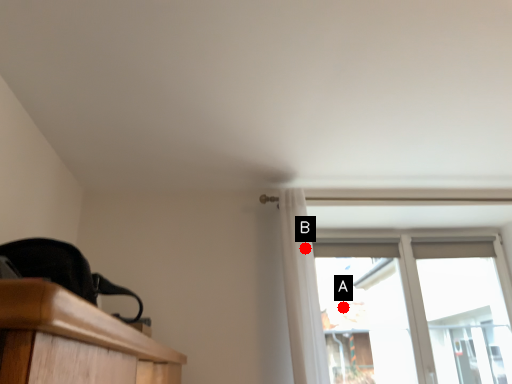
Question: Two points are circled on the image, labeled by A and B beside each circle. Which point appears farthest from the camera in this image?

Choices:
 (A) A is further
 (B) B is further

Answer: (A)